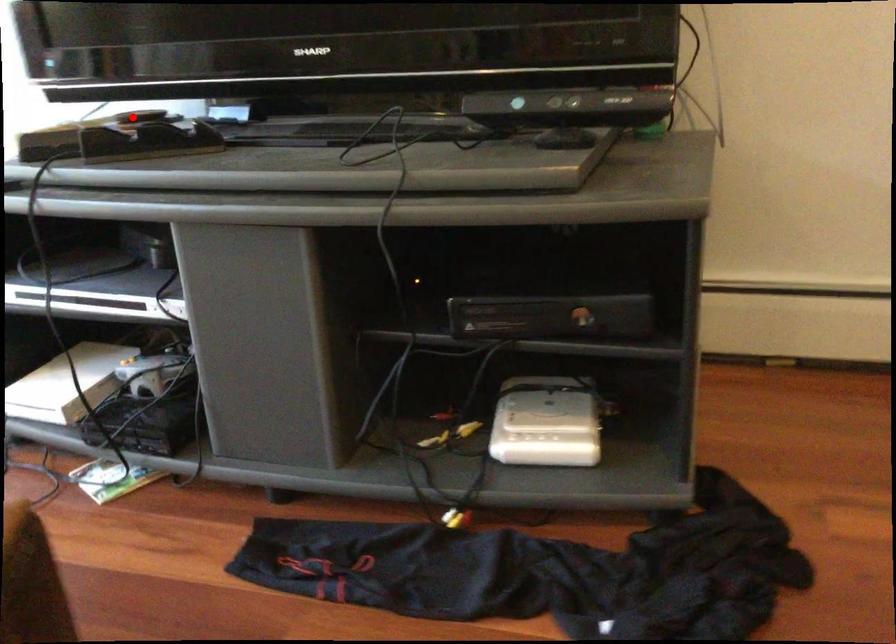
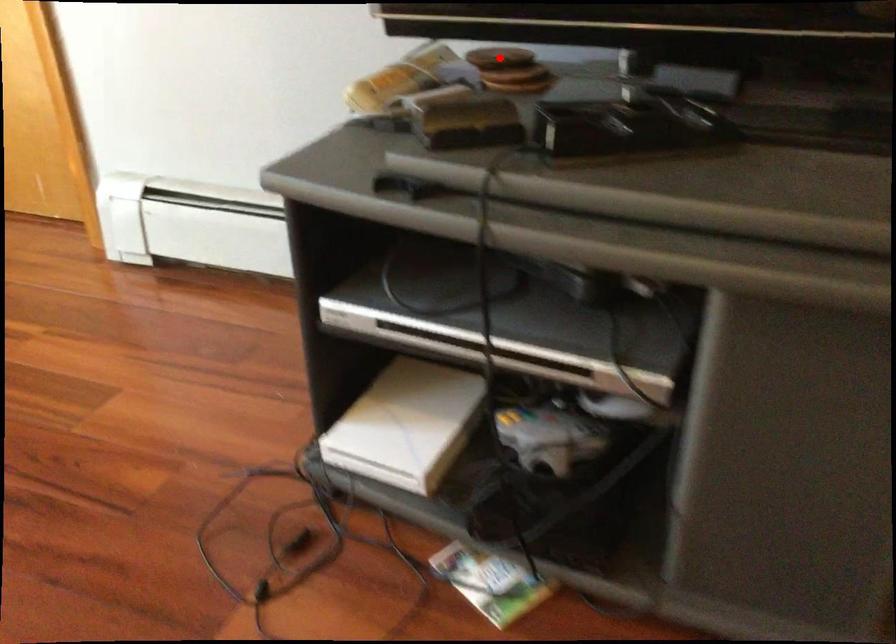
I am providing you with two images of the same scene from different viewpoints. A red point is marked on the first image and another point is marked on the second image. Are the points marked in image1 and image2 representing the same 3D position?

Yes